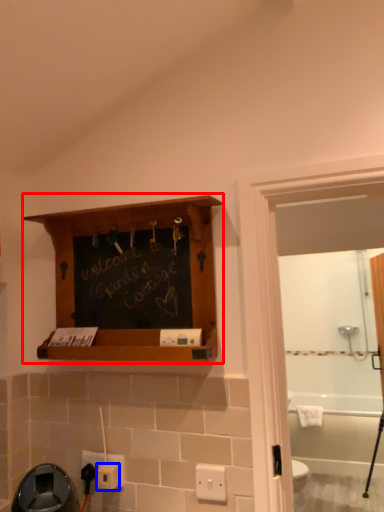
Question: Which object is further to the camera taking this photo, shelf (highlighted by a red box) or electric outlet (highlighted by a blue box)?

Choices:
 (A) shelf
 (B) electric outlet

Answer: (B)